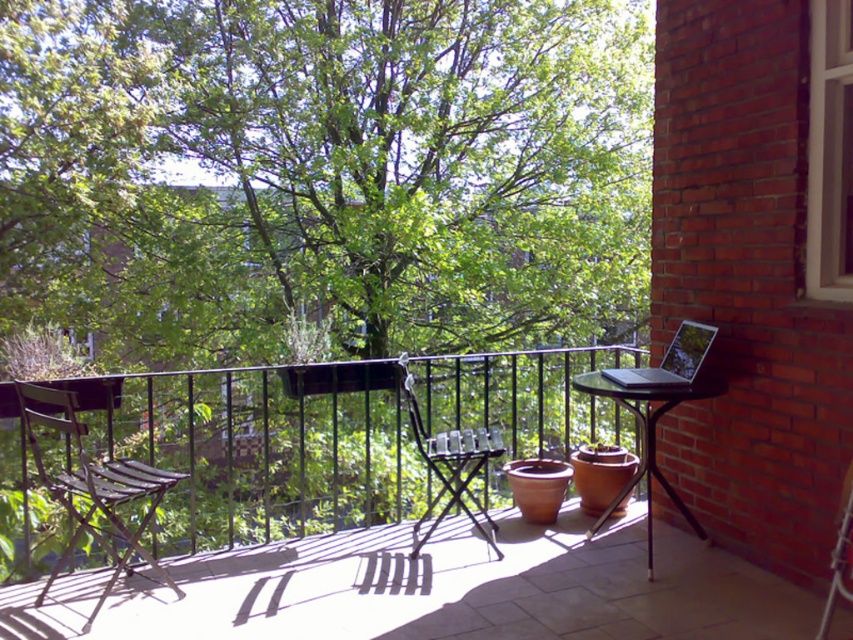
Looking at this image, you are planning to host a small gathering on the balcony and need to know if the wooden slatted chair at left and the black metal table at right can accommodate three people comfortably. Based on their sizes, can they fit three people sitting around them?

The wooden slatted chair at left is wider than the black metal table at right. However, a single chair and table combination typically accommodates one person. To seat three people, you would need additional chairs and a larger table. The current setup is insufficient for three guests.

You are planning to place a rectangular cushion that is 30 cm wide on the wooden slatted chair at left or the silver metallic laptop at right. Based on their widths, which object can accommodate the cushion without it hanging over the edges?

The wooden slatted chair at left has a greater width than the silver metallic laptop at right, so the cushion will fit better on the wooden slatted chair at left.

You are standing on the balcony and want to sit down. The wooden slatted chair at left is located at point [91,484]. If you face the railing, which direction should you move to reach the wooden slatted chair at left?

Since the wooden slatted chair at left is located at point [91,484], you should move to your left to reach it when facing the railing.